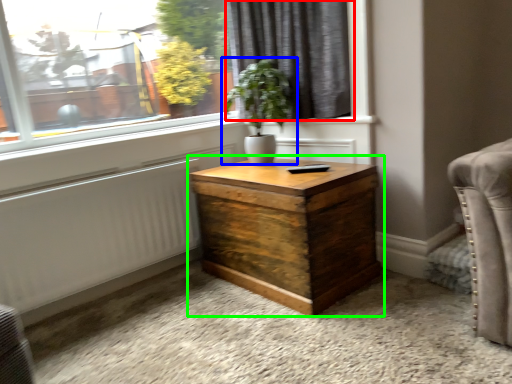
Question: Based on their relative distances, which object is nearer to curtain (highlighted by a red box)? Choose from houseplant (highlighted by a blue box) and nightstand (highlighted by a green box).

Choices:
 (A) houseplant
 (B) nightstand

Answer: (A)